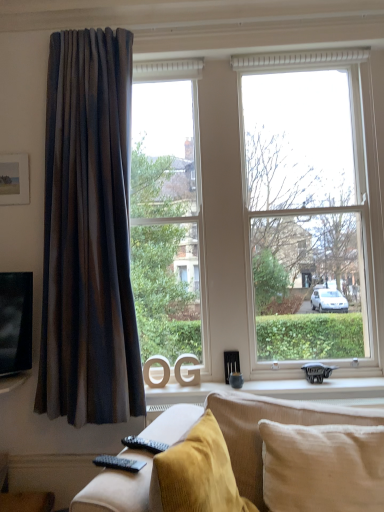
Question: Is beige cotton pillow at lower right at the left side of matte brown curtain at left?

Choices:
 (A) yes
 (B) no

Answer: (B)

Question: Does beige cotton pillow at lower right have a greater height compared to matte brown curtain at left?

Choices:
 (A) yes
 (B) no

Answer: (B)

Question: From a real-world perspective, is beige cotton pillow at lower right located higher than matte brown curtain at left?

Choices:
 (A) no
 (B) yes

Answer: (A)

Question: Considering the relative sizes of beige cotton pillow at lower right and matte brown curtain at left in the image provided, is beige cotton pillow at lower right thinner than matte brown curtain at left?

Choices:
 (A) no
 (B) yes

Answer: (A)

Question: Is beige cotton pillow at lower right wider than matte brown curtain at left?

Choices:
 (A) yes
 (B) no

Answer: (A)

Question: Is matte wooden picture frame at upper left taller or shorter than matte brown curtain at left?

Choices:
 (A) short
 (B) tall

Answer: (A)

Question: Based on their positions, is matte wooden picture frame at upper left located to the left or right of matte brown curtain at left?

Choices:
 (A) left
 (B) right

Answer: (A)

Question: Is matte wooden picture frame at upper left situated inside matte brown curtain at left or outside?

Choices:
 (A) inside
 (B) outside

Answer: (B)

Question: Is point (9, 203) closer or farther from the camera than point (119, 200)?

Choices:
 (A) closer
 (B) farther

Answer: (B)

Question: From the image's perspective, is white matte window sill at center located above or below transparent glass window at center?

Choices:
 (A) below
 (B) above

Answer: (A)

Question: From a real-world perspective, relative to transparent glass window at center, is white matte window sill at center vertically above or below?

Choices:
 (A) above
 (B) below

Answer: (B)

Question: Considering the positions of white matte window sill at center and transparent glass window at center in the image, is white matte window sill at center wider or thinner than transparent glass window at center?

Choices:
 (A) thin
 (B) wide

Answer: (A)

Question: Considering the positions of white matte window sill at center and transparent glass window at center in the image, is white matte window sill at center bigger or smaller than transparent glass window at center?

Choices:
 (A) small
 (B) big

Answer: (A)

Question: Looking at the image, does transparent glass window at center seem bigger or smaller compared to white matte window sill at center?

Choices:
 (A) small
 (B) big

Answer: (B)

Question: In the image, is transparent glass window at center positioned in front of or behind white matte window sill at center?

Choices:
 (A) behind
 (B) front

Answer: (A)